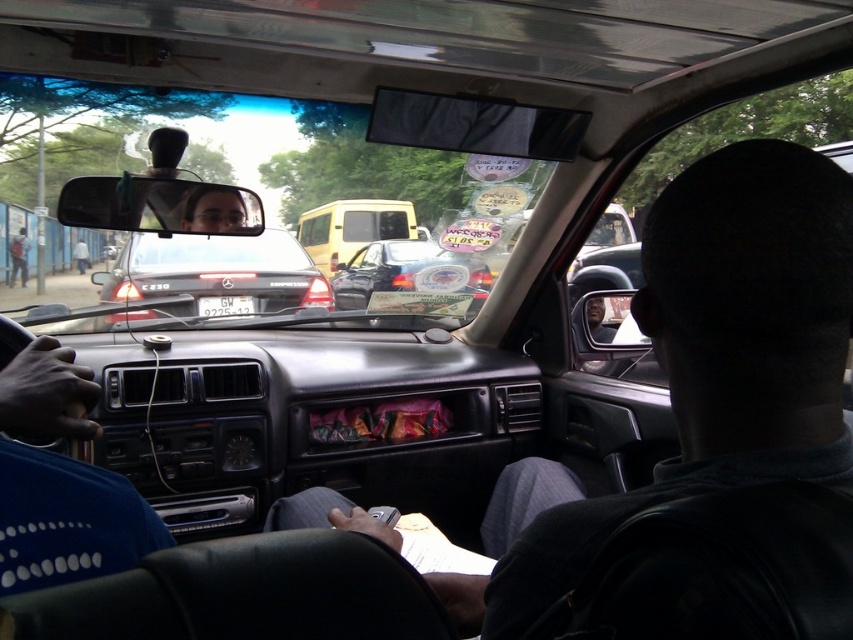
Question: Where is yellow matte van at center located in relation to white plastic license plate at center in the image?

Choices:
 (A) right
 (B) left

Answer: (A)

Question: Can you confirm if clear plastic mirror at center is positioned to the left of shiny black car at center?

Choices:
 (A) yes
 (B) no

Answer: (A)

Question: Which point is closer to the camera?

Choices:
 (A) (466, 257)
 (B) (21, 259)

Answer: (A)

Question: Is white plastic license plate at center below blue shirt at left?

Choices:
 (A) yes
 (B) no

Answer: (A)

Question: Which point is closer to the camera?

Choices:
 (A) (206, 208)
 (B) (20, 269)
 (C) (254, 260)
 (D) (221, 308)

Answer: (A)

Question: Which of these objects is positioned farthest from the white plastic license plate at center?

Choices:
 (A) light blue shirt at left
 (B) matte black car door at center
 (C) yellow matte van at center
 (D) clear plastic mirror at center

Answer: (C)